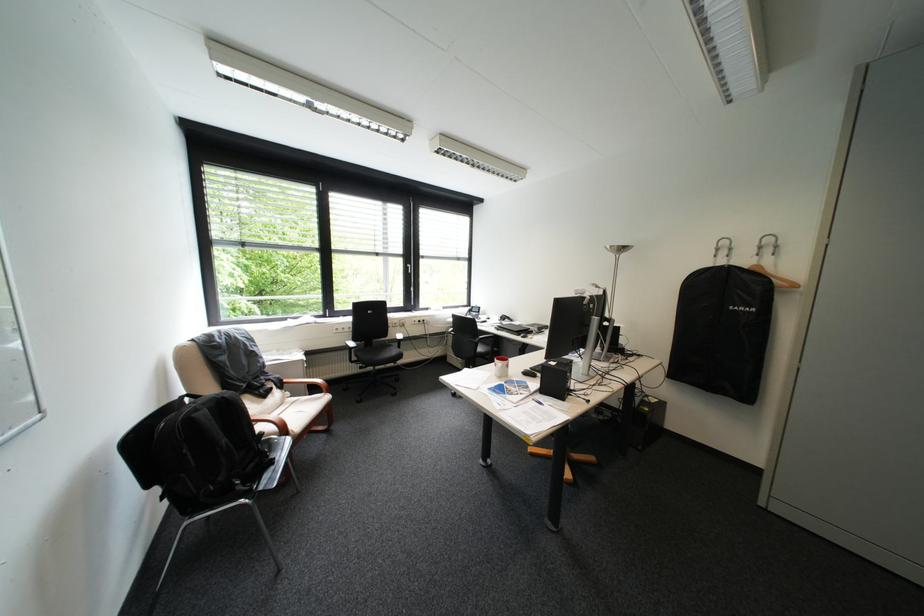
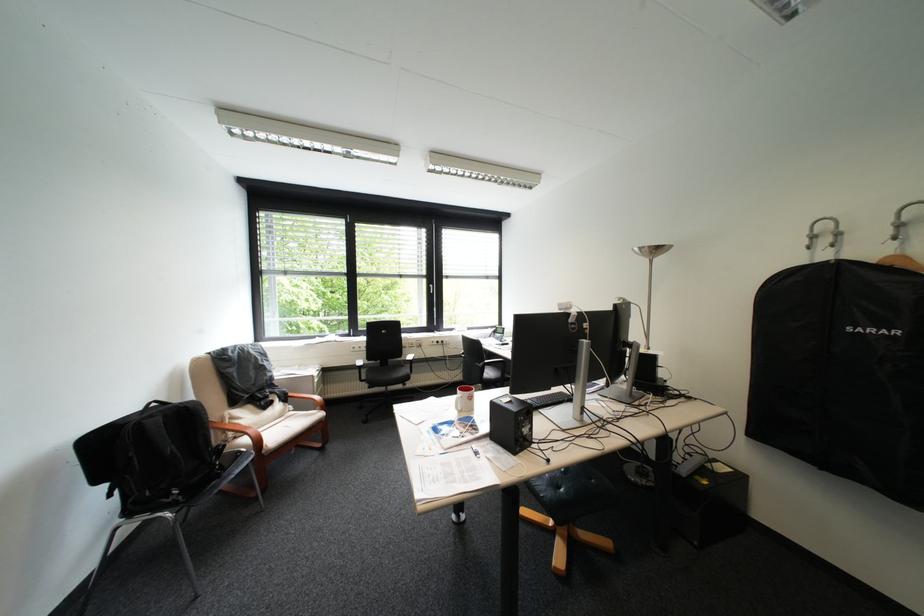
Question: Based on the continuous images, in which direction is the camera rotating? Reply with the corresponding letter.

Choices:
 (A) Left
 (B) Right
 (C) Up
 (D) Down

Answer: (A)